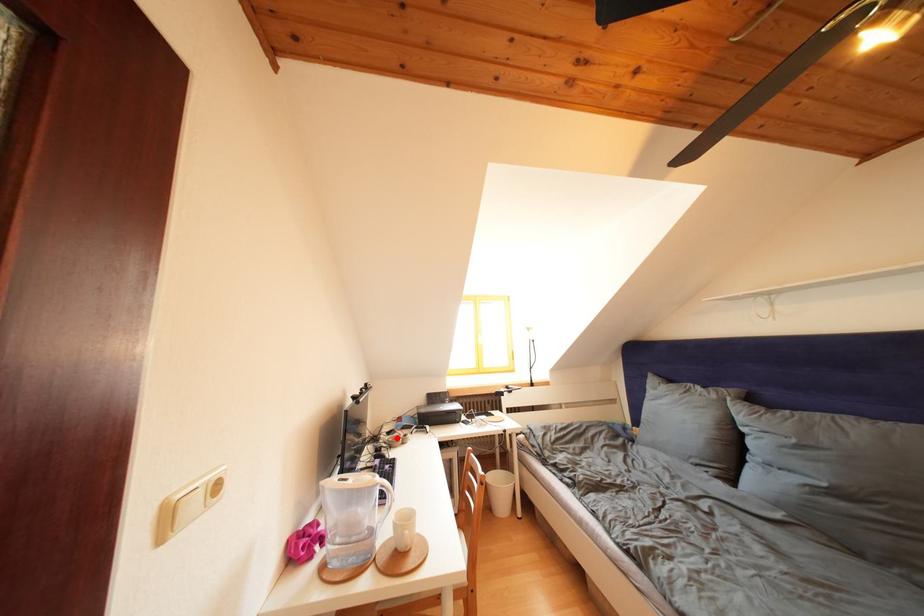
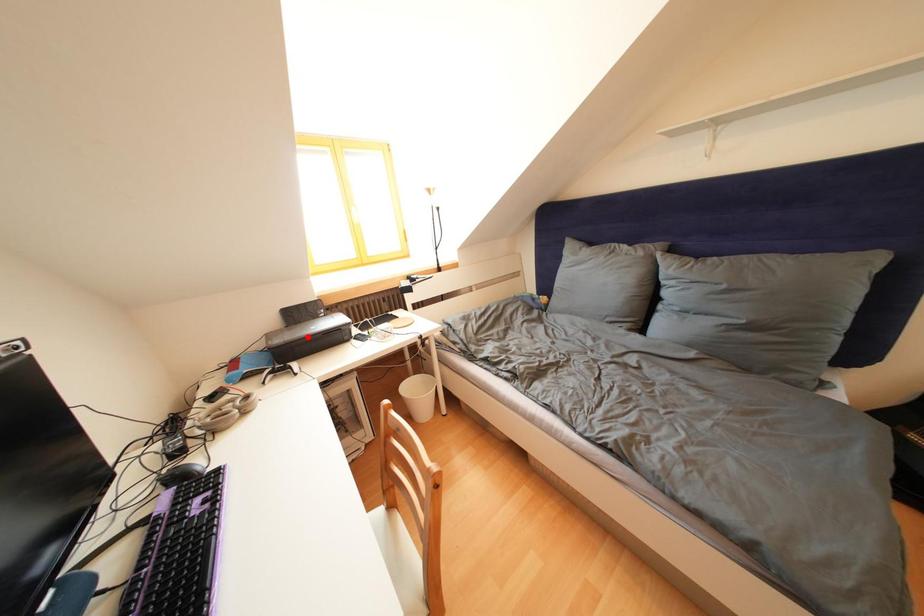
I am providing you with two images of the same scene from different viewpoints. A red point is marked on the first image and another point is marked on the second image. Is the marked point in image1 the same physical position as the marked point in image2?

No